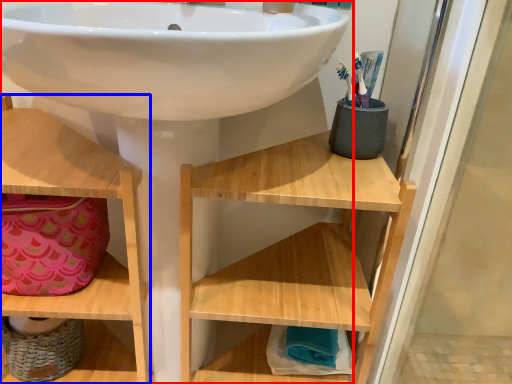
Question: Among these objects, which one is nearest to the camera, sink (highlighted by a red box) or shelf (highlighted by a blue box)?

Choices:
 (A) sink
 (B) shelf

Answer: (A)